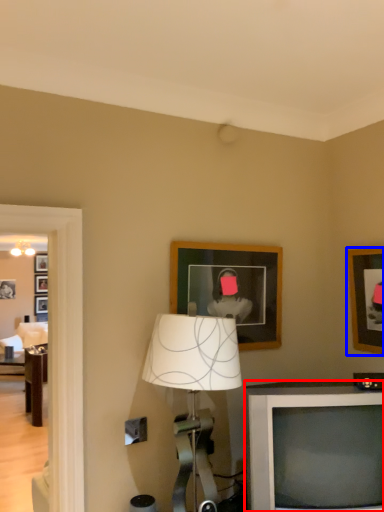
Question: Among these objects, which one is farthest to the camera, television (highlighted by a red box) or picture frame (highlighted by a blue box)?

Choices:
 (A) television
 (B) picture frame

Answer: (B)